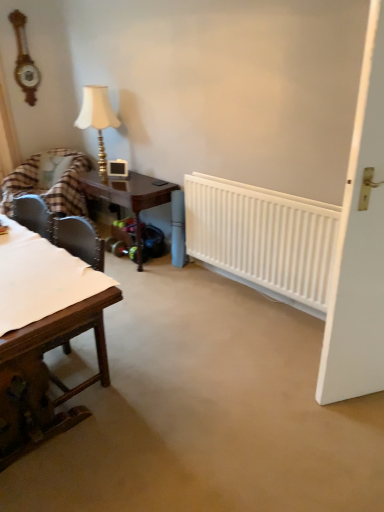
Where is `free space above wooden table at left, the 2th table when ordered from back to front (from a real-world perspective)`? free space above wooden table at left, the 2th table when ordered from back to front (from a real-world perspective) is located at coordinates (30, 263).